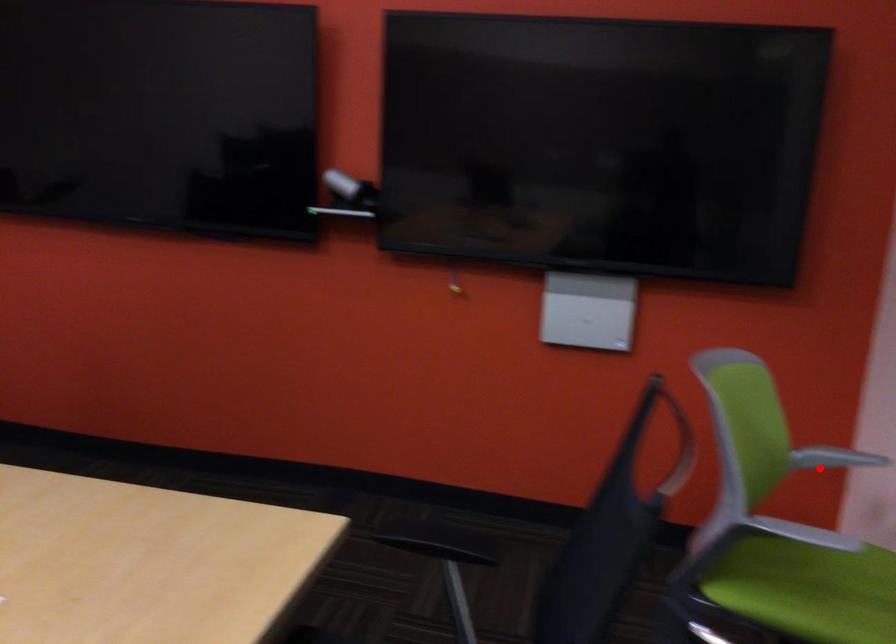
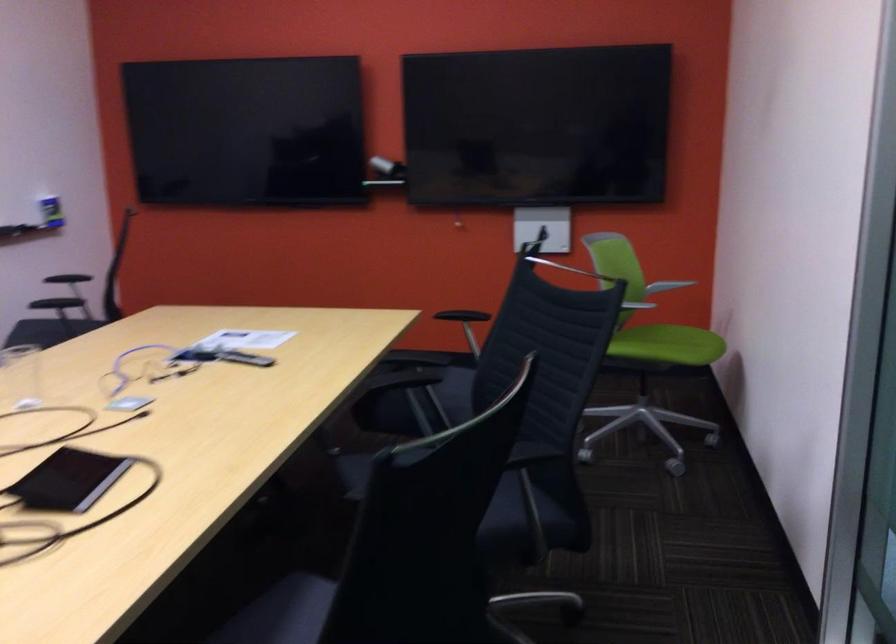
In the second image, find the point that corresponds to the highlighted location in the first image.

(666, 286)